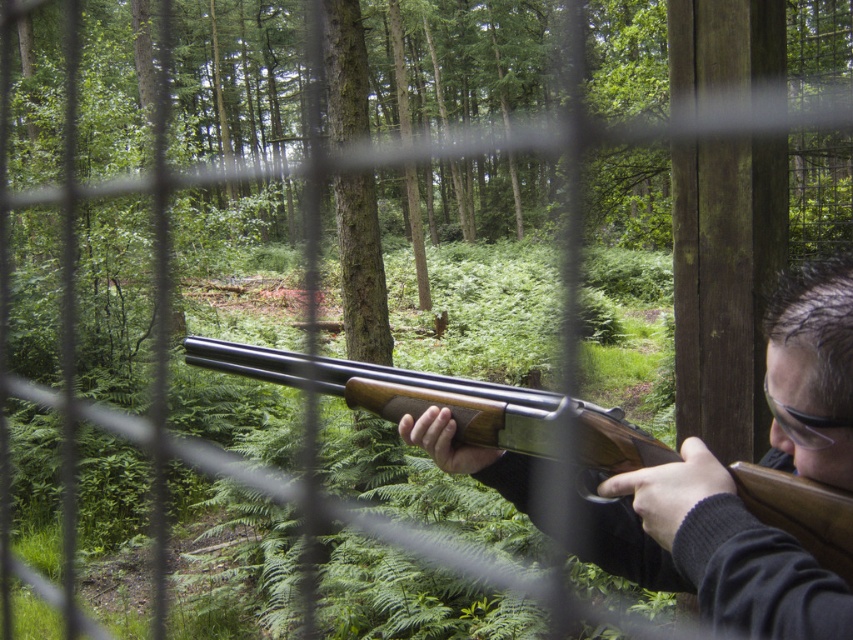
You are a forest guide and need to inform visitors about the equipment they can see in the image. Which object is taller, the wooden shotgun at center or the clear plastic goggles at upper right?

The wooden shotgun at center is taller than the clear plastic goggles at upper right according to the description.

You are a hunter in the forest. You have a wooden shotgun at center and clear plastic goggles at upper right. How far apart are these two items?

The wooden shotgun at center is 17.22 centimeters from clear plastic goggles at upper right.